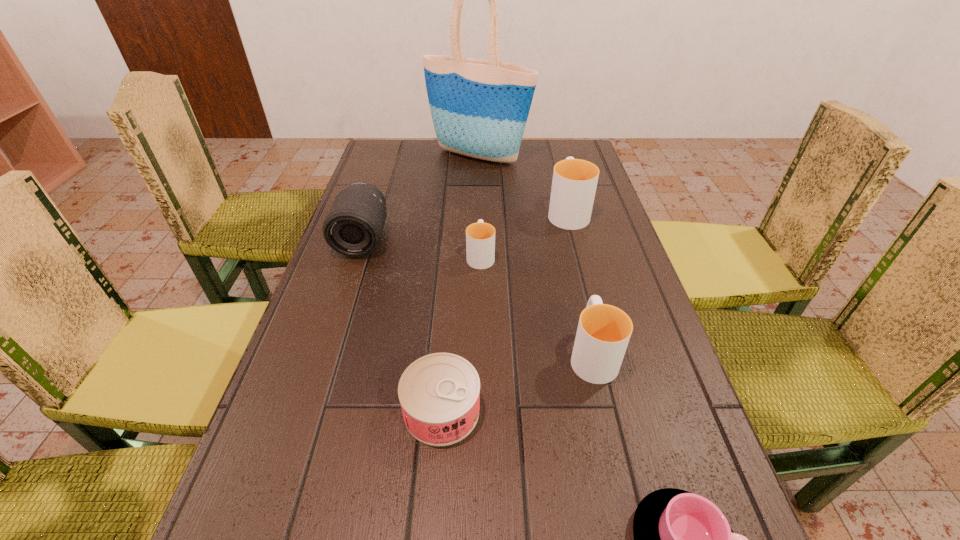
What are the coordinates of `the farthest object` in the screenshot? It's located at (479, 108).

Locate an element on the screen. The width and height of the screenshot is (960, 540). tote bag is located at coordinates (479, 108).

This screenshot has height=540, width=960. What are the coordinates of `the farthest yellow cup` in the screenshot? It's located at (574, 183).

Where is `the biggest yellow cup`? The width and height of the screenshot is (960, 540). the biggest yellow cup is located at coordinates (574, 183).

Image resolution: width=960 pixels, height=540 pixels. I want to click on the leftmost object, so pyautogui.click(x=353, y=227).

Where is `gray telephoto lens`? Image resolution: width=960 pixels, height=540 pixels. gray telephoto lens is located at coordinates (353, 227).

Find the location of a particular element. the fourth shortest object is located at coordinates (603, 333).

Identify the location of the second biggest yellow cup. (603, 333).

The image size is (960, 540). What are the coordinates of `the second farthest cup` in the screenshot? It's located at (480, 237).

Identify the location of the second nearest yellow cup. (480, 237).